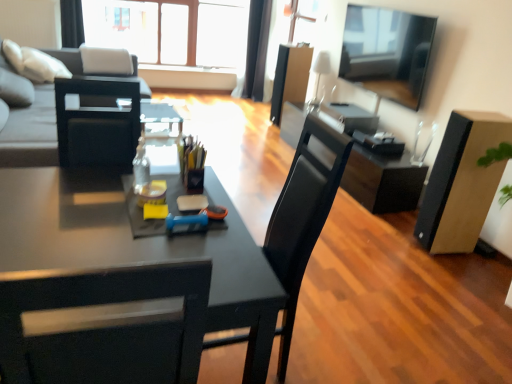
The width and height of the screenshot is (512, 384). In order to click on vacant location behind translucent glass bottle at center in this screenshot , I will do `click(152, 175)`.